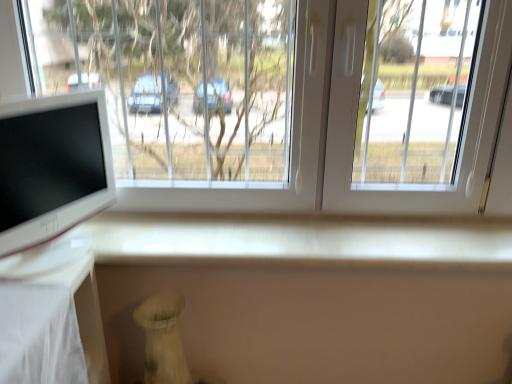
The width and height of the screenshot is (512, 384). In order to click on white glossy computer monitor at left in this screenshot , I will do `click(51, 178)`.

The height and width of the screenshot is (384, 512). Describe the element at coordinates (51, 178) in the screenshot. I see `white glossy computer monitor at left` at that location.

At what (x,y) coordinates should I click in order to perform the action: click on transparent glass window at upper center. Please return your answer as a coordinate pair (x, y). This screenshot has height=384, width=512. Looking at the image, I should click on (350, 132).

The image size is (512, 384). What do you see at coordinates (350, 132) in the screenshot?
I see `transparent glass window at upper center` at bounding box center [350, 132].

The width and height of the screenshot is (512, 384). Identify the location of white glossy computer monitor at left. (51, 178).

Considering the relative positions of white glossy computer monitor at left and transparent glass window at upper center in the image provided, is white glossy computer monitor at left to the right of transparent glass window at upper center from the viewer's perspective?

No, white glossy computer monitor at left is not to the right of transparent glass window at upper center.

Considering the positions of objects white glossy computer monitor at left and transparent glass window at upper center in the image provided, who is in front, white glossy computer monitor at left or transparent glass window at upper center?

Positioned in front is white glossy computer monitor at left.

Does point (106, 130) appear closer or farther from the camera than point (485, 134)?

Point (106, 130) appears to be closer to the viewer than point (485, 134).

From the image's perspective, which one is positioned lower, white glossy computer monitor at left or transparent glass window at upper center?

white glossy computer monitor at left.

From a real-world perspective, is white glossy computer monitor at left beneath transparent glass window at upper center?

Correct, in the physical world, white glossy computer monitor at left is lower than transparent glass window at upper center.

Considering the relative sizes of white glossy computer monitor at left and transparent glass window at upper center in the image provided, is white glossy computer monitor at left thinner than transparent glass window at upper center?

Yes.

Between white glossy computer monitor at left and transparent glass window at upper center, which one has less height?

With less height is white glossy computer monitor at left.

Between white glossy computer monitor at left and transparent glass window at upper center, which one has larger size?

Bigger between the two is transparent glass window at upper center.

Is white glossy computer monitor at left outside of transparent glass window at upper center?

Yes, white glossy computer monitor at left is not within transparent glass window at upper center.

Is there a large distance between white glossy computer monitor at left and transparent glass window at upper center?

No, white glossy computer monitor at left is not far from transparent glass window at upper center.

Does white glossy computer monitor at left turn towards transparent glass window at upper center?

No, white glossy computer monitor at left is not oriented towards transparent glass window at upper center.

Looking at this image, how many degrees apart are the facing directions of white glossy computer monitor at left and transparent glass window at upper center?

65.9 degrees.

Find the location of a particular element. This screenshot has height=384, width=512. window that is above the white glossy computer monitor at left (from the image's perspective) is located at coordinates click(350, 132).

Does transparent glass window at upper center appear on the left side of white glossy computer monitor at left?

Incorrect, transparent glass window at upper center is not on the left side of white glossy computer monitor at left.

Does transparent glass window at upper center lie behind white glossy computer monitor at left?

Yes.

Which is less distant, (x=334, y=27) or (x=19, y=193)?

Answer: Positioned in front is point (x=19, y=193).

From the image's perspective, who appears lower, transparent glass window at upper center or white glossy computer monitor at left?

white glossy computer monitor at left.

From a real-world perspective, which object rests below the other?

white glossy computer monitor at left is physically lower.

Considering the sizes of objects transparent glass window at upper center and white glossy computer monitor at left in the image provided, who is wider, transparent glass window at upper center or white glossy computer monitor at left?

Wider between the two is transparent glass window at upper center.

In terms of height, does transparent glass window at upper center look taller or shorter compared to white glossy computer monitor at left?

Considering their sizes, transparent glass window at upper center has more height than white glossy computer monitor at left.

Is transparent glass window at upper center bigger than white glossy computer monitor at left?

Yes.

Could white glossy computer monitor at left be considered to be inside transparent glass window at upper center?

No, transparent glass window at upper center does not contain white glossy computer monitor at left.

Is transparent glass window at upper center not close to white glossy computer monitor at left?

transparent glass window at upper center is actually quite close to white glossy computer monitor at left.

Is transparent glass window at upper center looking in the opposite direction of white glossy computer monitor at left?

Yes, transparent glass window at upper center is positioned with its back facing white glossy computer monitor at left.

How different are the orientations of transparent glass window at upper center and white glossy computer monitor at left in degrees?

65.9 degrees separate the facing orientations of transparent glass window at upper center and white glossy computer monitor at left.

Locate an element on the screen. The width and height of the screenshot is (512, 384). computer monitor located underneath the transparent glass window at upper center (from a real-world perspective) is located at coordinates (51, 178).

Identify the location of computer monitor below the transparent glass window at upper center (from a real-world perspective). This screenshot has height=384, width=512. (51, 178).

Where is `window lying above the white glossy computer monitor at left (from the image's perspective)`? window lying above the white glossy computer monitor at left (from the image's perspective) is located at coordinates (350, 132).